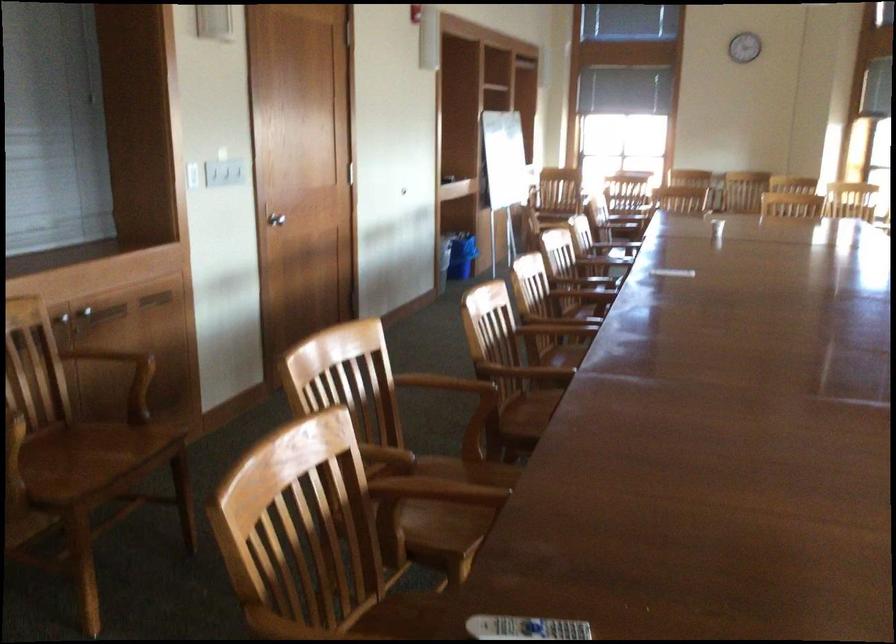
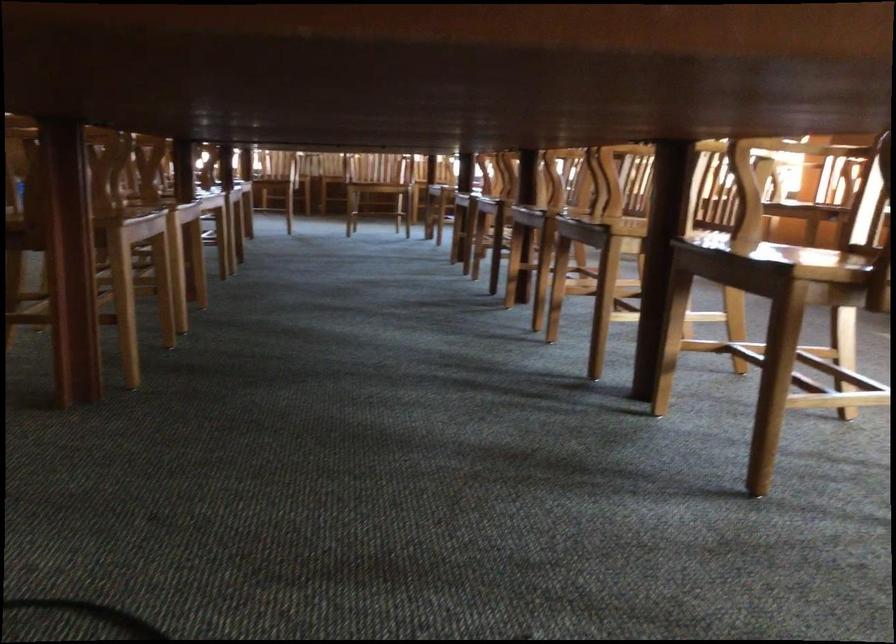
Question: The camera is either moving clockwise (left) or counter-clockwise (right) around the object. The first image is from the beginning of the video and the second image is from the end. Is the camera moving left or right when shooting the video?

Choices:
 (A) Left
 (B) Right

Answer: (A)